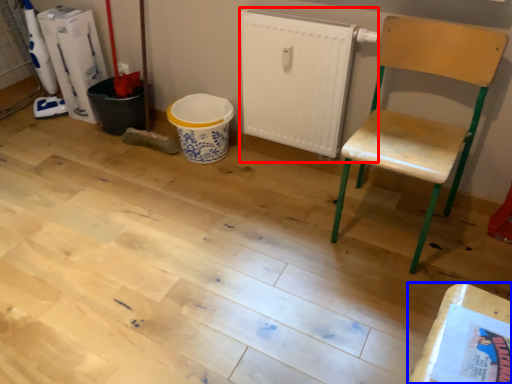
Question: Which point is further to the camera, radiator (highlighted by a red box) or table (highlighted by a blue box)?

Choices:
 (A) radiator
 (B) table

Answer: (A)